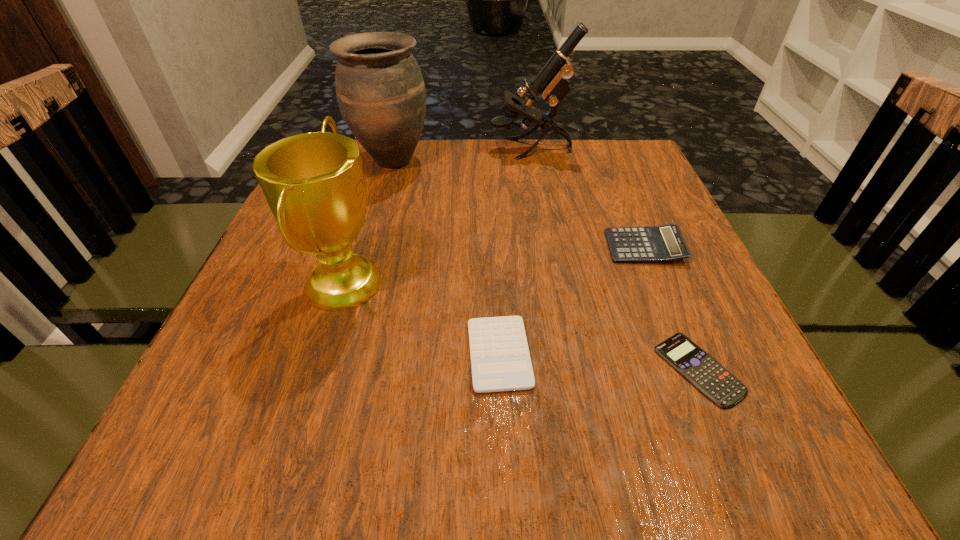
At what (x,y) coordinates should I click in order to perform the action: click on object positioned at the far left corner. Please return your answer as a coordinate pair (x, y). The height and width of the screenshot is (540, 960). Looking at the image, I should click on (381, 94).

The image size is (960, 540). I want to click on vacant space at the far edge of the desktop, so click(x=472, y=158).

This screenshot has width=960, height=540. In order to click on free space at the near edge of the desktop in this screenshot , I will do `click(536, 451)`.

In the image, there is a desktop. Identify the location of vacant region at the left edge. This screenshot has width=960, height=540. (213, 409).

Locate an element on the screen. The width and height of the screenshot is (960, 540). vacant space at the right edge is located at coordinates (751, 392).

The image size is (960, 540). In order to click on vacant space at the far right corner of the desktop in this screenshot , I will do `click(619, 156)`.

Image resolution: width=960 pixels, height=540 pixels. In order to click on vacant area that lies between the microscope and the urn in this screenshot , I will do `click(461, 154)`.

At what (x,y) coordinates should I click in order to perform the action: click on free point between the award and the urn. Please return your answer as a coordinate pair (x, y). The width and height of the screenshot is (960, 540). Looking at the image, I should click on (369, 221).

The height and width of the screenshot is (540, 960). I want to click on vacant space that is in between the urn and the second shortest calculator, so click(445, 257).

You are a GUI agent. You are given a task and a screenshot of the screen. Output one action in this format:
    pyautogui.click(x=<x>, y=<y>)
    Task: Click on the vacant space in between the award and the fifth tallest object
    The height and width of the screenshot is (540, 960).
    Given the screenshot: What is the action you would take?
    pyautogui.click(x=422, y=318)